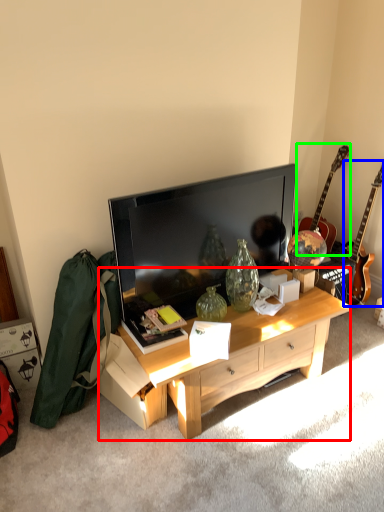
Question: Estimate the real-world distances between objects in this image. Which object is closer to desk (highlighted by a red box), guitar (highlighted by a blue box) or guitar (highlighted by a green box)?

Choices:
 (A) guitar
 (B) guitar

Answer: (A)